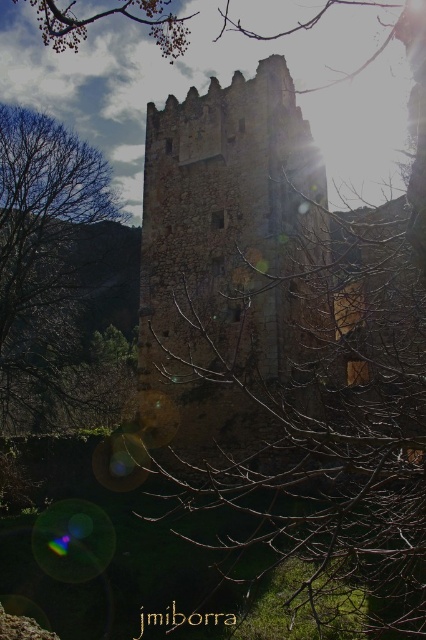
Is stone tower at center shorter than brown leafless tree at left?

Indeed, stone tower at center has a lesser height compared to brown leafless tree at left.

Image resolution: width=426 pixels, height=640 pixels. Find the location of `stone tower at center`. stone tower at center is located at coordinates (227, 241).

Find the location of `stone tower at center`. stone tower at center is located at coordinates (227, 241).